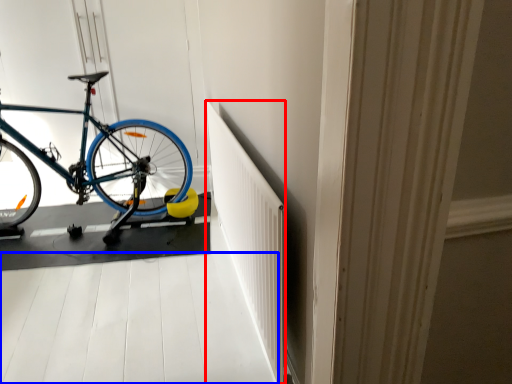
Question: Which of the following is the farthest to the observer, radiator (highlighted by a red box) or path (highlighted by a blue box)?

Choices:
 (A) radiator
 (B) path

Answer: (B)